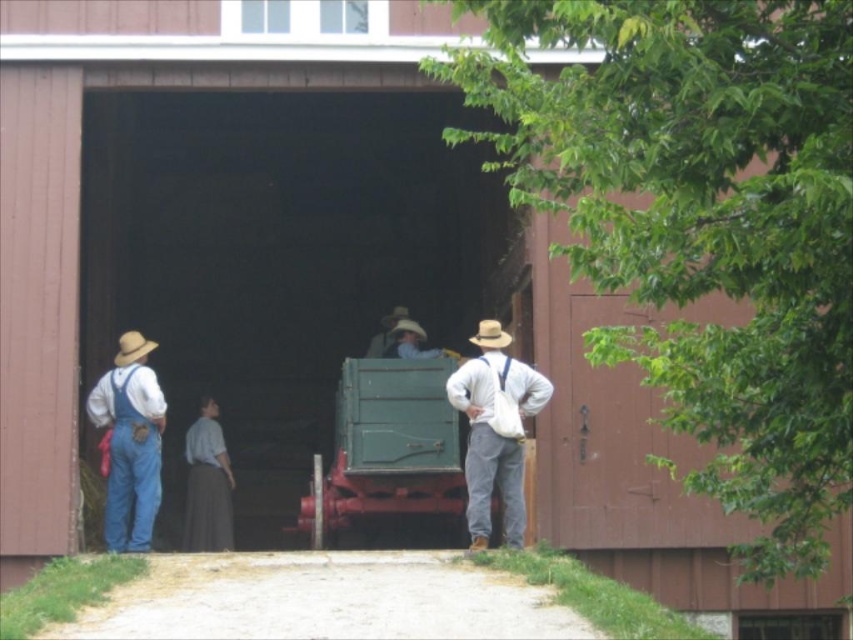
Question: Which object appears closest to the camera in this image?

Choices:
 (A) light blue shirt at center
 (B) light brown straw hat at center
 (C) light brown felt cowboy hat at center

Answer: (C)

Question: Does green matte wagon at center lie in front of light brown fabric hat at center?

Choices:
 (A) yes
 (B) no

Answer: (B)

Question: Among these objects, which one is farthest from the camera?

Choices:
 (A) light brown felt cowboy hat at center
 (B) denim overalls at left
 (C) green matte wagon at center
 (D) light brown leather hat at center

Answer: (D)

Question: Where is light brown fabric hat at center located in relation to light brown straw cowboy hat at left in the image?

Choices:
 (A) right
 (B) left

Answer: (A)

Question: Considering the relative positions of green matte wagon at center and light brown fabric hat at center in the image provided, where is green matte wagon at center located with respect to light brown fabric hat at center?

Choices:
 (A) right
 (B) left

Answer: (B)

Question: Among these objects, which one is nearest to the camera?

Choices:
 (A) light brown felt cowboy hat at center
 (B) green matte wagon at center
 (C) light brown straw cowboy hat at left
 (D) light brown fabric hat at center

Answer: (D)